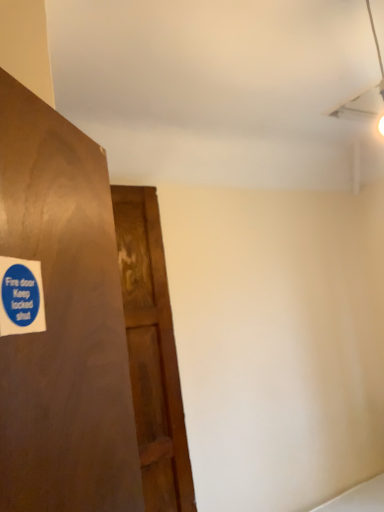
You are a GUI agent. You are given a task and a screenshot of the screen. Output one action in this format:
    pyautogui.click(x=<x>, y=<y>)
    Task: Click on the blue paper sticker at left
    The image size is (384, 512).
    Given the screenshot: What is the action you would take?
    pyautogui.click(x=21, y=297)

Describe the element at coordinates (21, 297) in the screenshot. I see `blue paper sticker at left` at that location.

Measure the distance between point (30, 324) and camera.

The distance of point (30, 324) from camera is 22.95 inches.

Image resolution: width=384 pixels, height=512 pixels. What are the coordinates of `wooden door at left` in the screenshot? It's located at (152, 352).

Measure the distance between point (159, 246) and camera.

6.68 feet.

Measure the distance between wooden door at left and camera.

A distance of 5.75 feet exists between wooden door at left and camera.

What do you see at coordinates (152, 352) in the screenshot? This screenshot has width=384, height=512. I see `wooden door at left` at bounding box center [152, 352].

Identify the location of blue paper sticker at left. Image resolution: width=384 pixels, height=512 pixels. (x=21, y=297).

Which object is positioned more to the right, wooden door at left or blue paper sticker at left?

wooden door at left.

Which is behind, wooden door at left or blue paper sticker at left?

wooden door at left is further from the camera.

Between point (163, 347) and point (26, 330), which one is positioned behind?

Point (163, 347)

From the picture: From the image's perspective, between wooden door at left and blue paper sticker at left, which one is located above?

blue paper sticker at left, from the image's perspective.

From a real-world perspective, who is located lower, wooden door at left or blue paper sticker at left?

wooden door at left is physically lower.

Which of these two, wooden door at left or blue paper sticker at left, is thinner?

blue paper sticker at left is thinner.

Considering the relative sizes of wooden door at left and blue paper sticker at left in the image provided, is wooden door at left taller than blue paper sticker at left?

Yes, wooden door at left is taller than blue paper sticker at left.

Does wooden door at left have a larger size compared to blue paper sticker at left?

Yes, wooden door at left is bigger than blue paper sticker at left.

Is wooden door at left situated inside blue paper sticker at left or outside?

wooden door at left cannot be found inside blue paper sticker at left.

Would you say wooden door at left is a long distance from blue paper sticker at left?

wooden door at left is far away from blue paper sticker at left.

In the scene shown: Could you tell me if wooden door at left is facing blue paper sticker at left?

No, wooden door at left is not turned towards blue paper sticker at left.

What's the angular difference between wooden door at left and blue paper sticker at left's facing directions?

They differ by 46.2 degrees in their facing directions.

You are a GUI agent. You are given a task and a screenshot of the screen. Output one action in this format:
    pyautogui.click(x=<x>, y=<y>)
    Task: Click on the door behind the blue paper sticker at left
    The width and height of the screenshot is (384, 512).
    Given the screenshot: What is the action you would take?
    pyautogui.click(x=152, y=352)

Is blue paper sticker at left at the left side of wooden door at left?

Yes, blue paper sticker at left is to the left of wooden door at left.

Relative to wooden door at left, is blue paper sticker at left in front or behind?

blue paper sticker at left is positioned closer to the viewer than wooden door at left.

Considering the positions of point (19, 264) and point (119, 195), is point (19, 264) closer or farther from the camera than point (119, 195)?

Point (19, 264) appears to be closer to the viewer than point (119, 195).

Looking at this image, from the image's perspective, is blue paper sticker at left above wooden door at left?

Yes, from the image's perspective, blue paper sticker at left is above wooden door at left.

From a real-world perspective, who is located lower, blue paper sticker at left or wooden door at left?

wooden door at left.

Which of these two, blue paper sticker at left or wooden door at left, is wider?

Wider between the two is wooden door at left.

Considering the sizes of objects blue paper sticker at left and wooden door at left in the image provided, who is taller, blue paper sticker at left or wooden door at left?

Standing taller between the two is wooden door at left.

Considering the relative sizes of blue paper sticker at left and wooden door at left in the image provided, is blue paper sticker at left smaller than wooden door at left?

Yes, blue paper sticker at left is smaller than wooden door at left.

Is blue paper sticker at left positioned beyond the bounds of wooden door at left?

That's correct, blue paper sticker at left is outside of wooden door at left.

Is blue paper sticker at left not close to wooden door at left?

That's right, there is a large distance between blue paper sticker at left and wooden door at left.

Is blue paper sticker at left positioned with its back to wooden door at left?

blue paper sticker at left does not have its back to wooden door at left.

Locate an element on the screen. Image resolution: width=384 pixels, height=512 pixels. door below the blue paper sticker at left (from the image's perspective) is located at coordinates (152, 352).

The image size is (384, 512). I want to click on door located underneath the blue paper sticker at left (from a real-world perspective), so click(x=152, y=352).

This screenshot has height=512, width=384. What are the coordinates of `sticker above the wooden door at left (from the image's perspective)` in the screenshot? It's located at (21, 297).